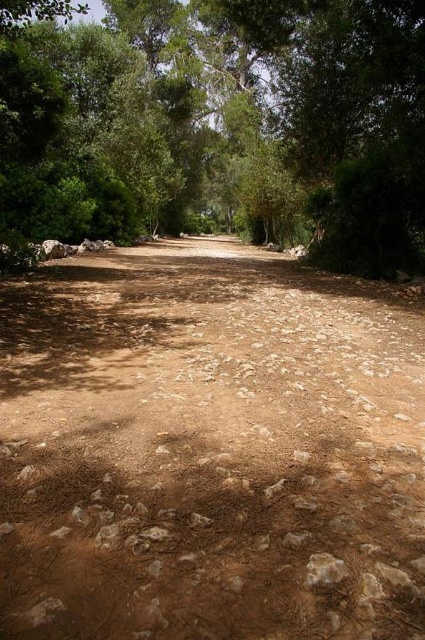
Which is below, brown dirt road at center or brown rough stone at lower center?

brown rough stone at lower center

Consider the image. Is brown dirt road at center to the left of brown rough stone at lower center from the viewer's perspective?

Correct, you'll find brown dirt road at center to the left of brown rough stone at lower center.

This screenshot has width=425, height=640. Describe the element at coordinates (218, 124) in the screenshot. I see `brown dirt road at center` at that location.

The width and height of the screenshot is (425, 640). Find the location of `brown dirt road at center`. brown dirt road at center is located at coordinates (218, 124).

Between brown rocky dirt track at center and brown rough stone at lower center, which one is positioned higher?

brown rocky dirt track at center is higher up.

Is brown rocky dirt track at center above brown rough stone at lower center?

Correct, brown rocky dirt track at center is located above brown rough stone at lower center.

Is point (8, 426) behind point (320, 582)?

Yes, point (8, 426) is behind point (320, 582).

I want to click on brown rocky dirt track at center, so click(207, 449).

Does brown rocky dirt track at center have a lesser width compared to brown dirt road at center?

Yes, brown rocky dirt track at center is thinner than brown dirt road at center.

Can you confirm if brown rocky dirt track at center is positioned above brown dirt road at center?

No.

This screenshot has height=640, width=425. Identify the location of brown rocky dirt track at center. (207, 449).